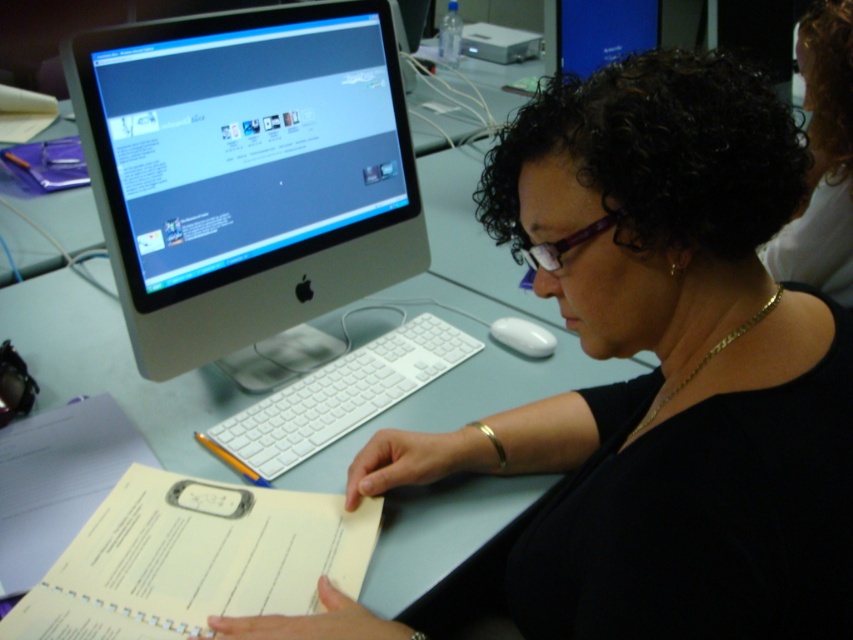
Question: Is black matte computer monitor at upper left closer to camera compared to blue glossy monitor at upper center?

Choices:
 (A) yes
 (B) no

Answer: (A)

Question: Which of the following is the farthest from the observer?

Choices:
 (A) (339, 221)
 (B) (288, 496)
 (C) (573, 241)

Answer: (A)

Question: Among these points, which one is nearest to the camera?

Choices:
 (A) (850, 284)
 (B) (119, 506)
 (C) (606, 228)

Answer: (C)

Question: Which object appears closest to the camera in this image?

Choices:
 (A) yellow paper at lower left
 (B) black matte computer monitor at upper left

Answer: (B)

Question: Can you confirm if black matte computer monitor at upper left is wider than sleek silver monitor at upper left?

Choices:
 (A) yes
 (B) no

Answer: (A)

Question: Observing the image, what is the correct spatial positioning of purple plastic glasses at center in reference to white matte mouse at center?

Choices:
 (A) left
 (B) right

Answer: (A)